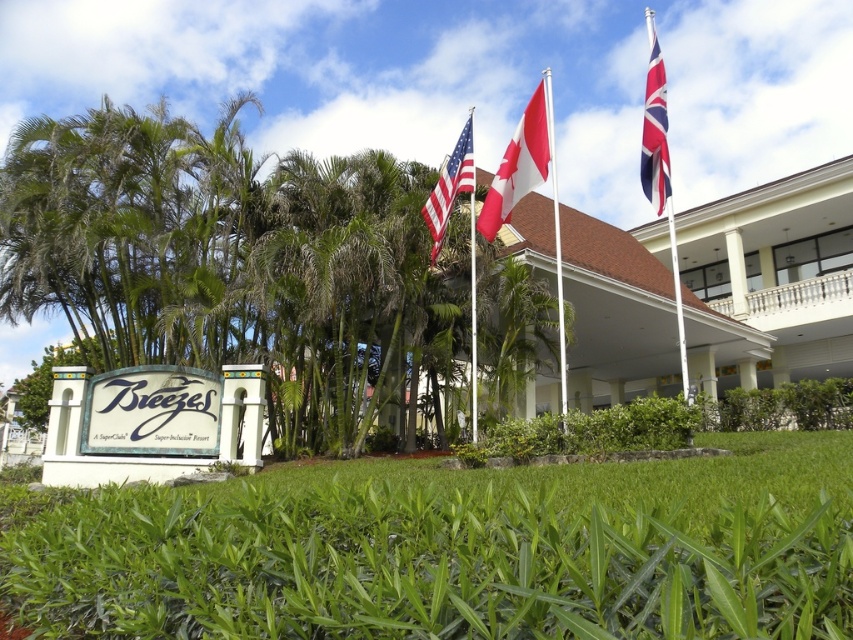
Does green leafy grass at lower center have a greater width compared to red fabric flagpole at center?

In fact, green leafy grass at lower center might be narrower than red fabric flagpole at center.

Which is above, green leafy grass at lower center or red fabric flagpole at center?

red fabric flagpole at center is above.

Between point (215, 586) and point (560, 296), which one is positioned in front?

Positioned in front is point (215, 586).

Where is `green leafy grass at lower center`? Image resolution: width=853 pixels, height=640 pixels. green leafy grass at lower center is located at coordinates (457, 552).

Consider the image. Does american flag at upper center have a lesser width compared to red fabric flagpole at center?

Yes, american flag at upper center is thinner than red fabric flagpole at center.

Who is more distant from viewer, (453,150) or (555,240)?

The point (555,240) is more distant.

Does point (454, 176) lie in front of point (560, 362)?

That is True.

Identify the location of american flag at upper center. The width and height of the screenshot is (853, 640). (450, 186).

Which is more to the left, red and white striped flag at upper right or american flag at upper center?

american flag at upper center

Who is more distant from viewer, (647,97) or (467,180)?

Positioned behind is point (467,180).

Where is `red and white striped flag at upper right`? red and white striped flag at upper right is located at coordinates (654, 132).